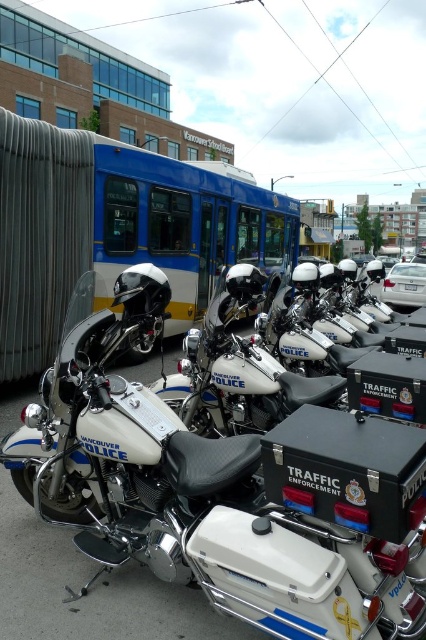
Question: Where is blue metallic bus at upper center located in relation to white matte police motorcycle at center in the image?

Choices:
 (A) left
 (B) right

Answer: (A)

Question: Can you confirm if white metallic police motorcycle at center is positioned above blue metallic bus at upper center?

Choices:
 (A) yes
 (B) no

Answer: (B)

Question: Which of the following is the closest to the observer?

Choices:
 (A) blue metallic bus at upper center
 (B) white metallic police motorcycle at center

Answer: (B)

Question: Is white metallic police motorcycle at center above blue metallic bus at upper center?

Choices:
 (A) no
 (B) yes

Answer: (A)

Question: Estimate the real-world distances between objects in this image. Which object is closer to the white matte police motorcycle at center?

Choices:
 (A) blue metallic bus at upper center
 (B) white metallic police motorcycle at center

Answer: (B)

Question: Which point is closer to the camera taking this photo?

Choices:
 (A) (267, 225)
 (B) (222, 410)

Answer: (B)